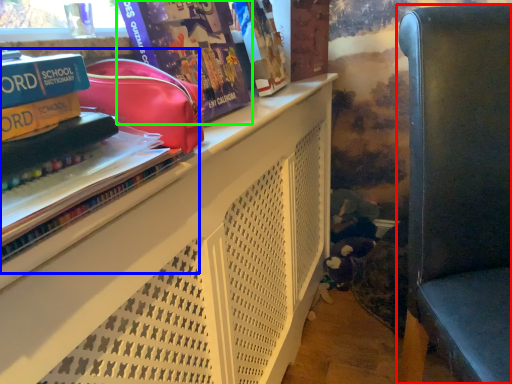
Question: Based on their relative distances, which object is nearer to furniture (highlighted by a red box)? Choose from book (highlighted by a blue box) and comic book (highlighted by a green box).

Choices:
 (A) book
 (B) comic book

Answer: (B)